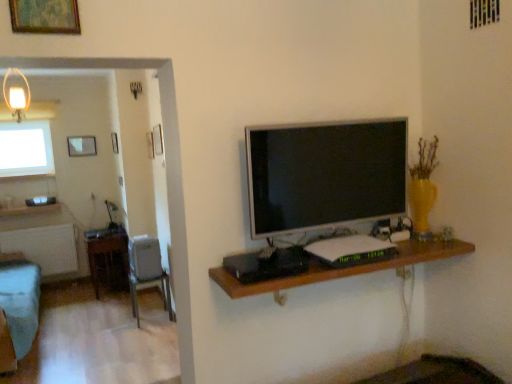
Question: From a real-world perspective, does wooden table at left sit lower than wooden shelf at center?

Choices:
 (A) yes
 (B) no

Answer: (A)

Question: Is wooden table at left outside of wooden shelf at center?

Choices:
 (A) yes
 (B) no

Answer: (A)

Question: From the image's perspective, would you say wooden table at left is positioned over wooden shelf at center?

Choices:
 (A) no
 (B) yes

Answer: (A)

Question: Considering the relative sizes of wooden table at left and wooden shelf at center in the image provided, is wooden table at left thinner than wooden shelf at center?

Choices:
 (A) yes
 (B) no

Answer: (B)

Question: Can you confirm if wooden table at left is bigger than wooden shelf at center?

Choices:
 (A) yes
 (B) no

Answer: (A)

Question: Is matte glass picture frame at upper left, the third picture frame positioned from the front, to the left or to the right of wooden table at left in the image?

Choices:
 (A) left
 (B) right

Answer: (A)

Question: Do you think matte glass picture frame at upper left, the 1th picture frame from the back, is within wooden table at left, or outside of it?

Choices:
 (A) outside
 (B) inside

Answer: (A)

Question: From the image's perspective, is matte glass picture frame at upper left, the 1th picture frame from the back, located above or below wooden table at left?

Choices:
 (A) above
 (B) below

Answer: (A)

Question: Is point (91, 139) closer or farther from the camera than point (117, 258)?

Choices:
 (A) closer
 (B) farther

Answer: (B)

Question: In terms of height, does gold-framed artwork at upper left, the third picture frame when ordered from back to front, look taller or shorter compared to white frosted glass window at upper left?

Choices:
 (A) short
 (B) tall

Answer: (A)

Question: Is point (34, 9) closer or farther from the camera than point (16, 153)?

Choices:
 (A) closer
 (B) farther

Answer: (A)

Question: Is gold-framed artwork at upper left, the third picture frame positioned from the left, to the left or to the right of white frosted glass window at upper left in the image?

Choices:
 (A) left
 (B) right

Answer: (B)

Question: From the image's perspective, relative to white frosted glass window at upper left, is gold-framed artwork at upper left, the third picture frame positioned from the left, above or below?

Choices:
 (A) below
 (B) above

Answer: (B)

Question: Is matte glass lampshade at upper left in front of or behind matte glass picture frame at upper left, the 1th picture frame from the back, in the image?

Choices:
 (A) behind
 (B) front

Answer: (B)

Question: From the image's perspective, is matte glass lampshade at upper left above or below matte glass picture frame at upper left, arranged as the third picture frame when viewed from the right?

Choices:
 (A) above
 (B) below

Answer: (A)